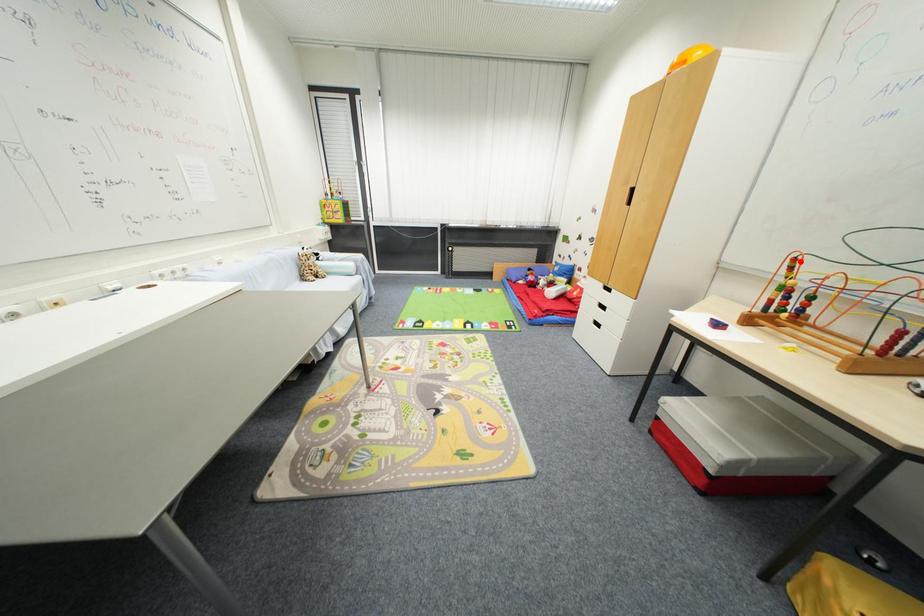
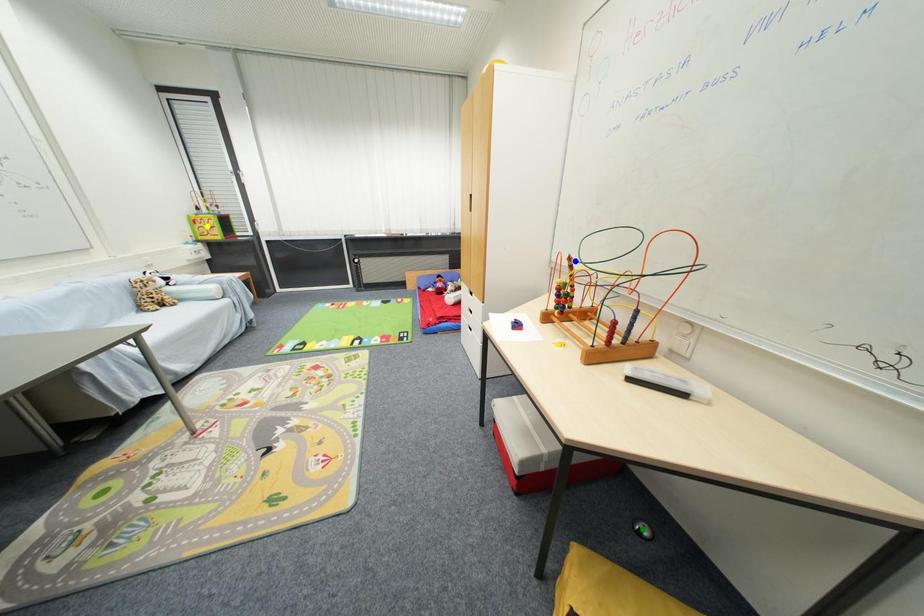
Question: I am providing you with two images of the same scene from different viewpoints. A red point is marked on the first image. You are given multiple points on the second image. Which point in image 2 is actually the same real-world point as the red point in image 1?

Choices:
 (A) green point
 (B) blue point
 (C) yellow point

Answer: (B)